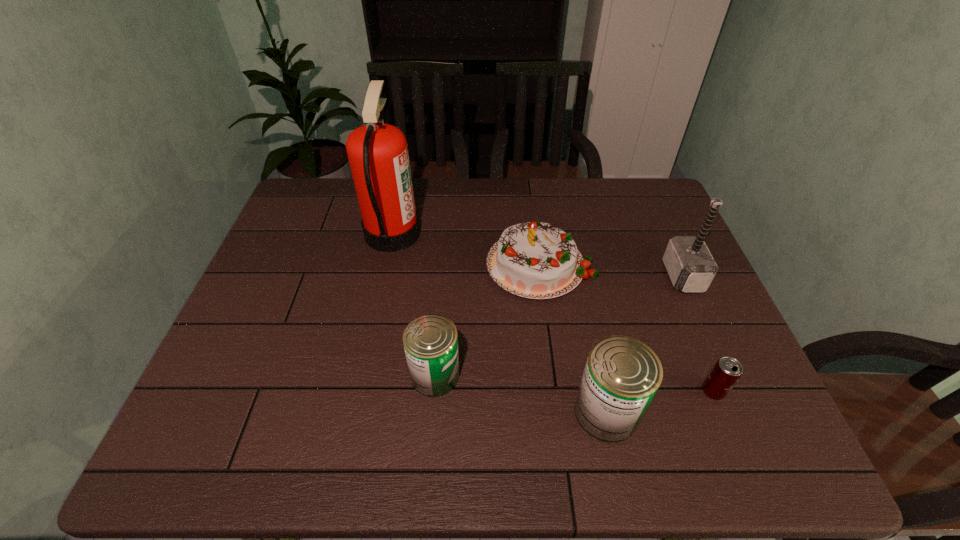
Find the location of `the second object from left to right`. the second object from left to right is located at coordinates (430, 341).

Locate an element on the screen. The height and width of the screenshot is (540, 960). the shorter can is located at coordinates (430, 341).

Find the location of a particular element. the right can is located at coordinates (622, 375).

At what (x,y) coordinates should I click in order to perform the action: click on the second tallest object. Please return your answer as a coordinate pair (x, y). Looking at the image, I should click on (688, 261).

This screenshot has height=540, width=960. What are the coordinates of `cake` in the screenshot? It's located at 537,260.

The width and height of the screenshot is (960, 540). Find the location of `the tallest object`. the tallest object is located at coordinates (377, 152).

Locate an element on the screen. Image resolution: width=960 pixels, height=540 pixels. fire extinguisher is located at coordinates (377, 152).

The height and width of the screenshot is (540, 960). Find the location of `beer can`. beer can is located at coordinates (726, 372).

Where is `free point located 0.250m on the right of the left can`? This screenshot has width=960, height=540. free point located 0.250m on the right of the left can is located at coordinates (569, 375).

Image resolution: width=960 pixels, height=540 pixels. I want to click on free region located 0.260m on the back of the taller can, so click(582, 297).